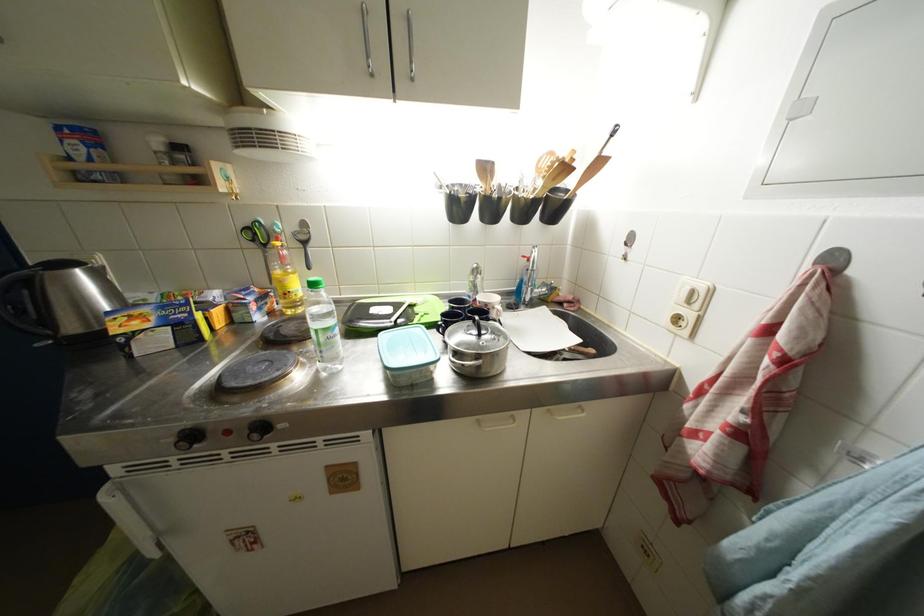
At what (x,y) coordinates should I click in order to perform the action: click on white light switch. Please return your answer as a coordinate pair (x, y). Image resolution: width=924 pixels, height=616 pixels. Looking at the image, I should click on (693, 294).